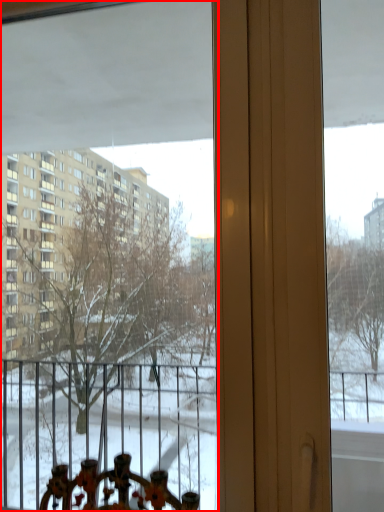
Question: From the image's perspective, considering the relative positions of window (annotated by the red box) and window screen in the image provided, where is window (annotated by the red box) located with respect to the staircase?

Choices:
 (A) below
 (B) above

Answer: (B)